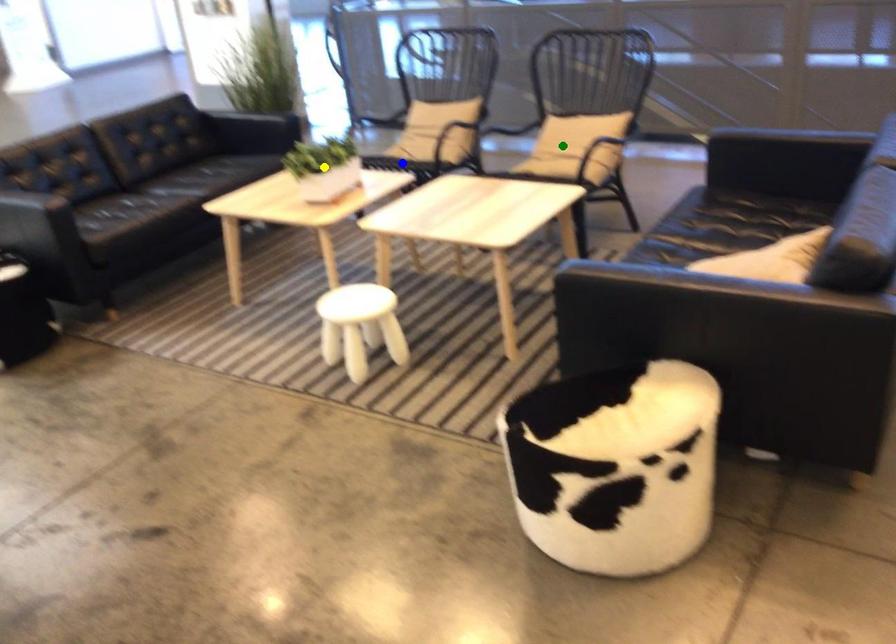
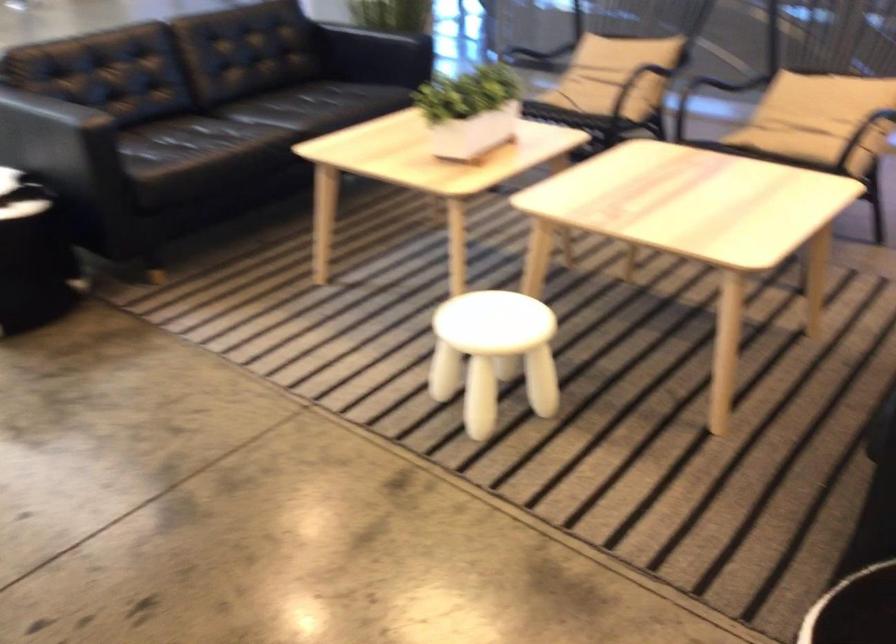
I am providing you with two images of the same scene from different viewpoints. Three points are marked in image1. Which point corresponds to a part or object that is occluded in image2?In image1, three points are marked. Which of them correspond to a part or object that is occluded in image2?Among the three points shown in image1, which one corresponds to a part or object that is no longer visible due to occlusion in image2?

Invisible in image2: blue point.